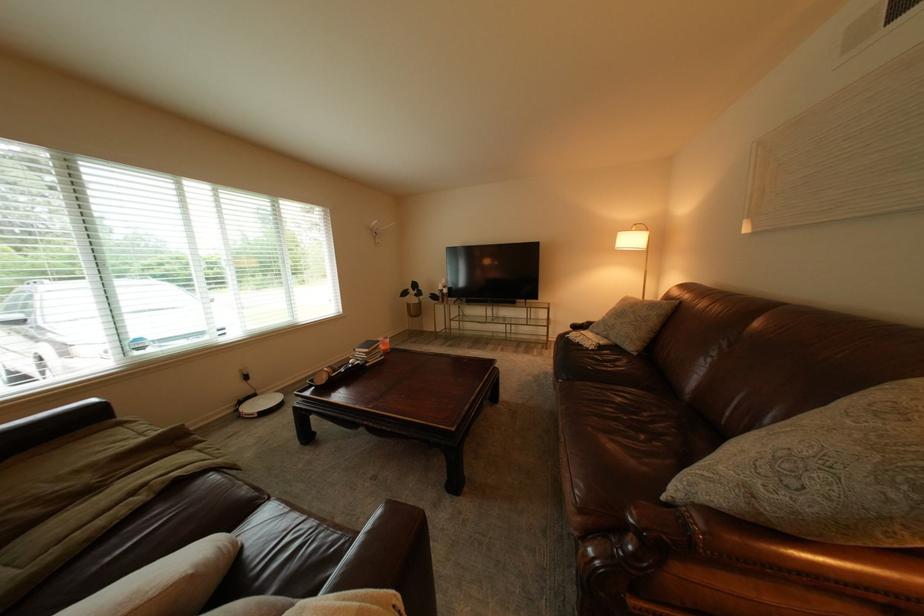
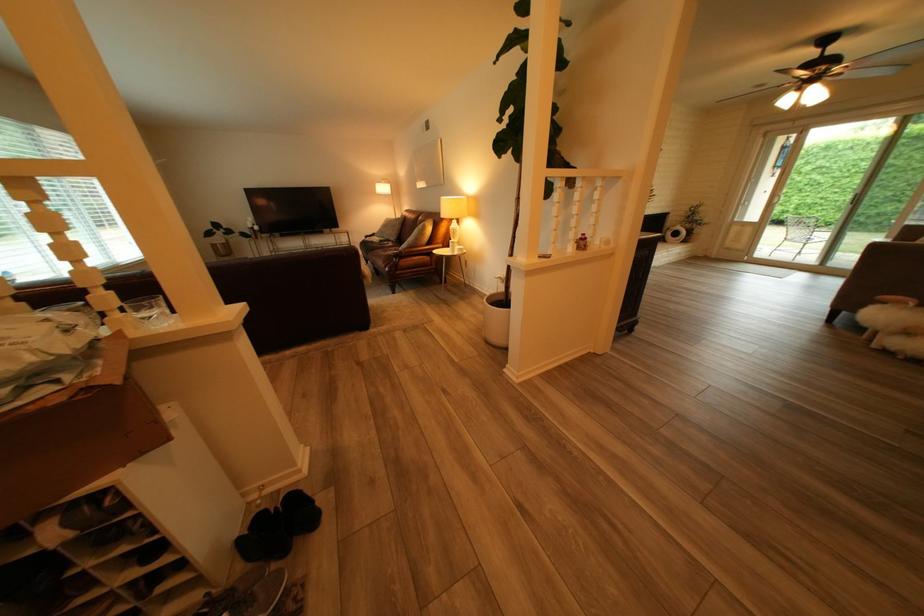
In the second image, find the point that corresponds to the point at 589,328 in the first image.

(381, 238)